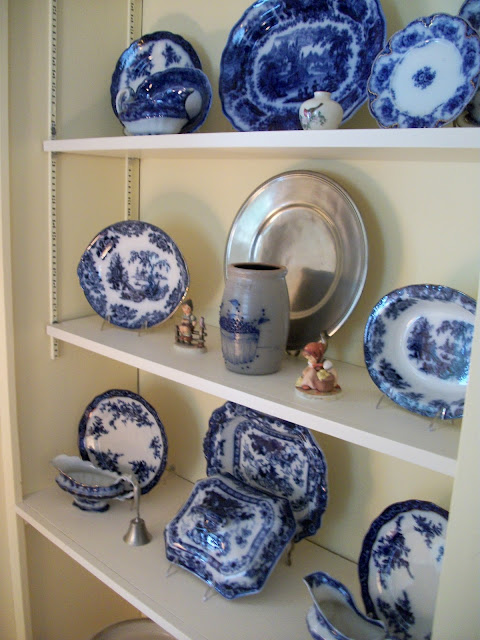
This screenshot has width=480, height=640. What are the coordinates of `strips to hold up shelves` in the screenshot? It's located at (53, 244), (129, 194), (53, 24), (131, 13).